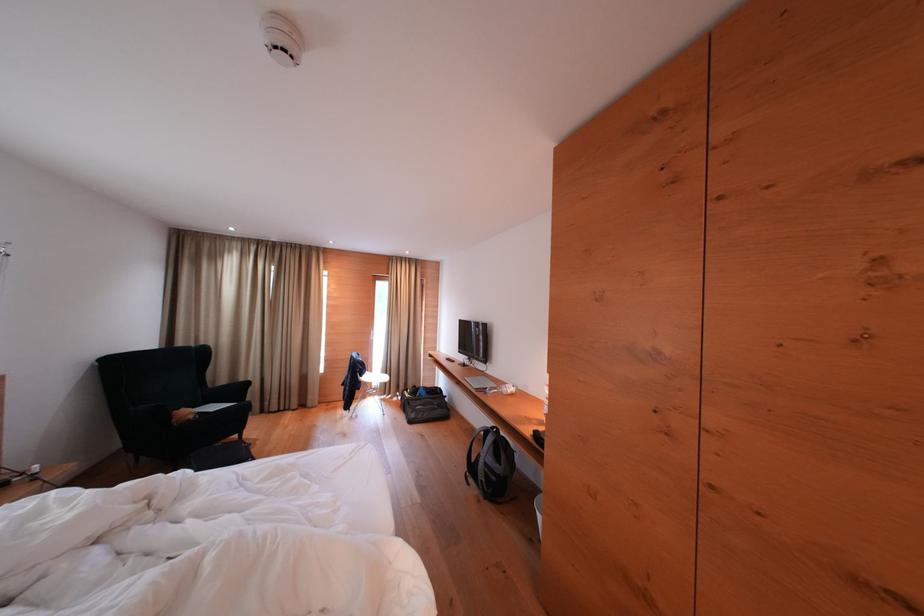
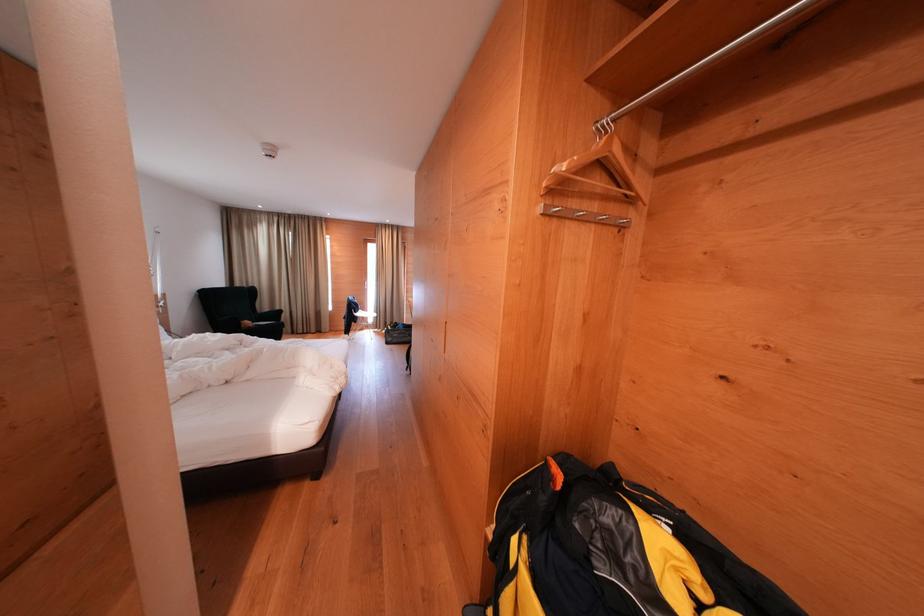
Locate, in the second image, the point that corresponds to [192,416] in the first image.

(254, 328)